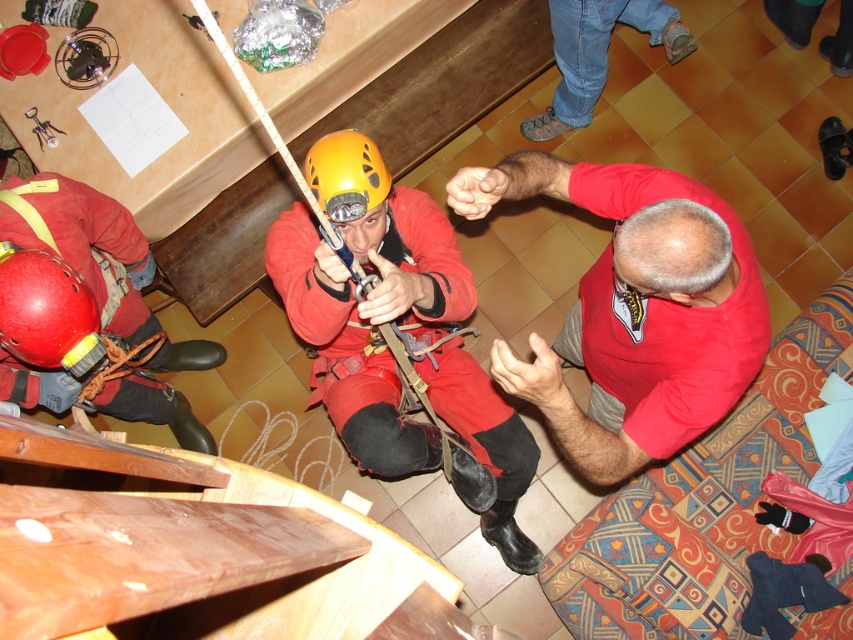
You are standing at the back of the room and want to reach the point closer to the camera between the two points labeled point (x=123, y=384) and point (x=62, y=356). Which point should you head towards?

You should head towards point (x=62, y=356) because it is closer to the camera compared to point (x=123, y=384).

You are an observer in the room and want to know which clothing item is larger between the matte red climbing suit at center and the jeans at upper center. Which one is larger?

The matte red climbing suit at center is bigger than the jeans at upper center.